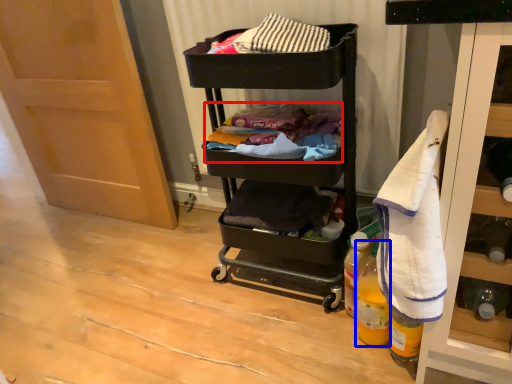
Question: Among these objects, which one is nearest to the camera, laundry (highlighted by a red box) or bottle (highlighted by a blue box)?

Choices:
 (A) laundry
 (B) bottle

Answer: (B)